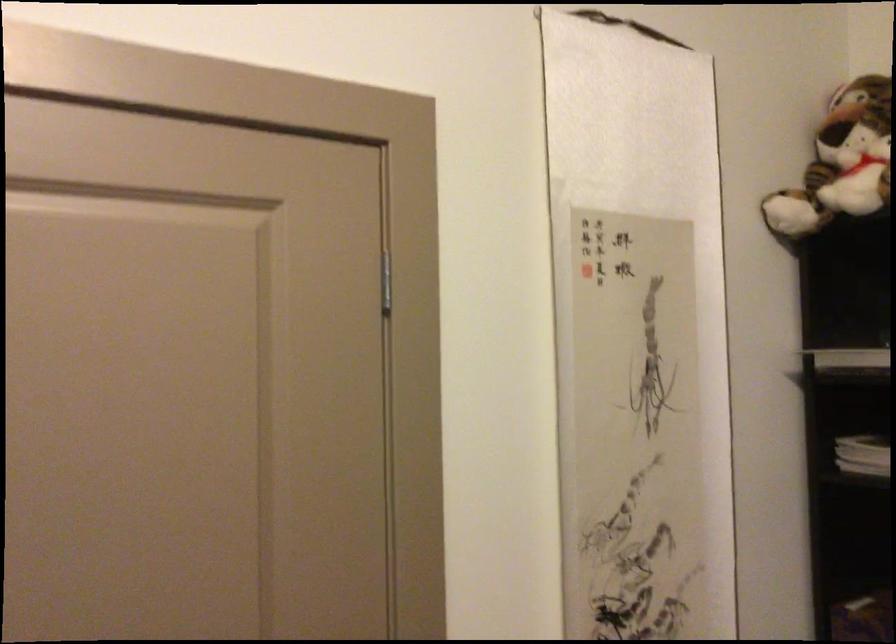
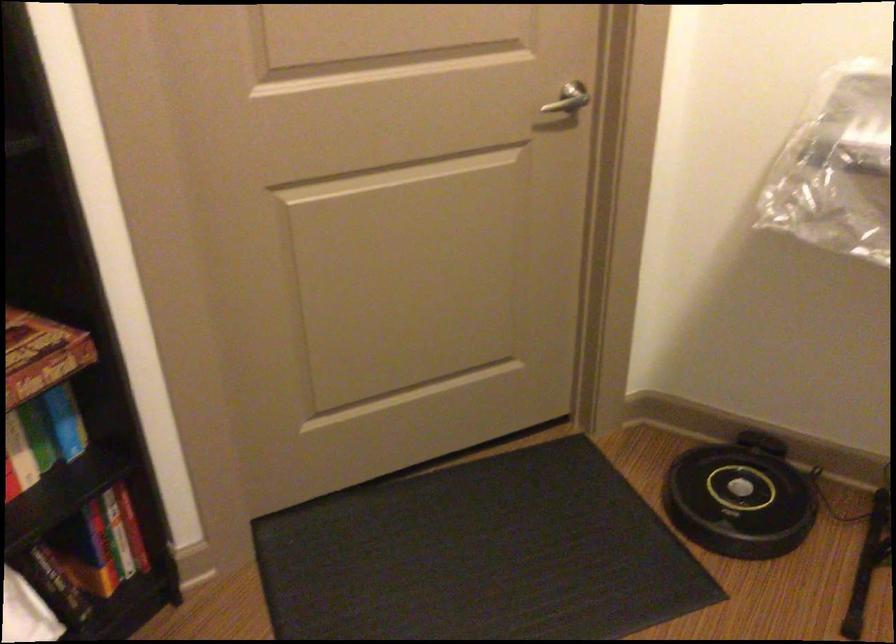
How did the camera likely rotate?

The camera rotated toward right-down.